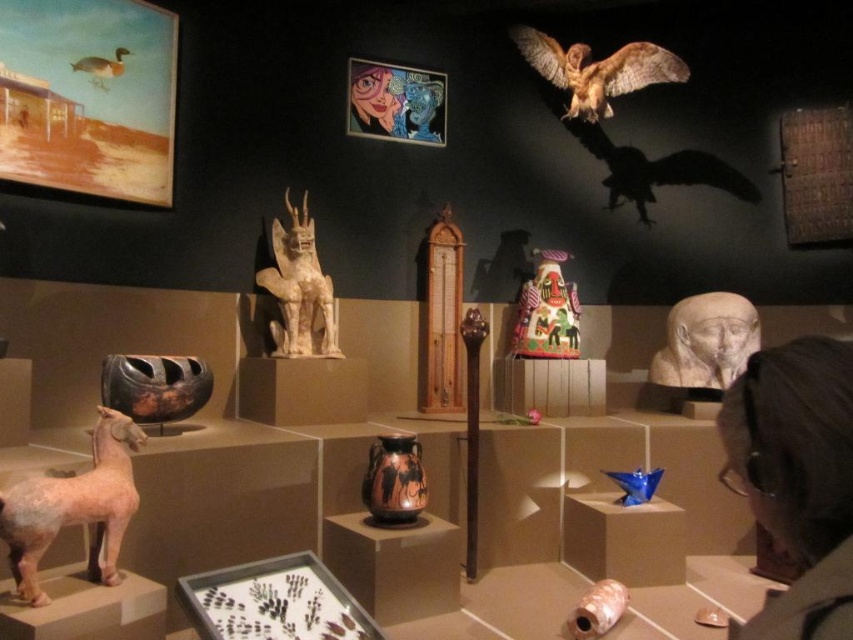
You are an art student who wants to sketch the white stone statue at center and the painted ceramic figure at center. Which one should you look up to observe from your current position?

The white stone statue at center is above the painted ceramic figure at center, so you should look up to observe the white stone statue at center.

You are an art curator trying to arrange two new items in the museum. You have a small bronze sculpture and a large wooden carving. The white stone statue at center and the brown matte duck at upper left are already in place. Based on their sizes, which existing artifact should you place the small sculpture next to and the large carving next to?

The white stone statue at center is wider than the brown matte duck at upper left. Therefore, the small bronze sculpture should be placed next to the brown matte duck at upper left, and the large wooden carving should be placed next to the white stone statue at center to maintain proportional spacing.

You are standing in the museum and want to take a photo of the matte pink statue at lower left. If your camera has a maximum focus range of 6 feet, will it be able to capture the statue clearly?

The matte pink statue at lower left is 5.83 feet away from the viewer, which is within the camera maximum focus range of 6 feet. Therefore, the camera can capture the statue clearly.